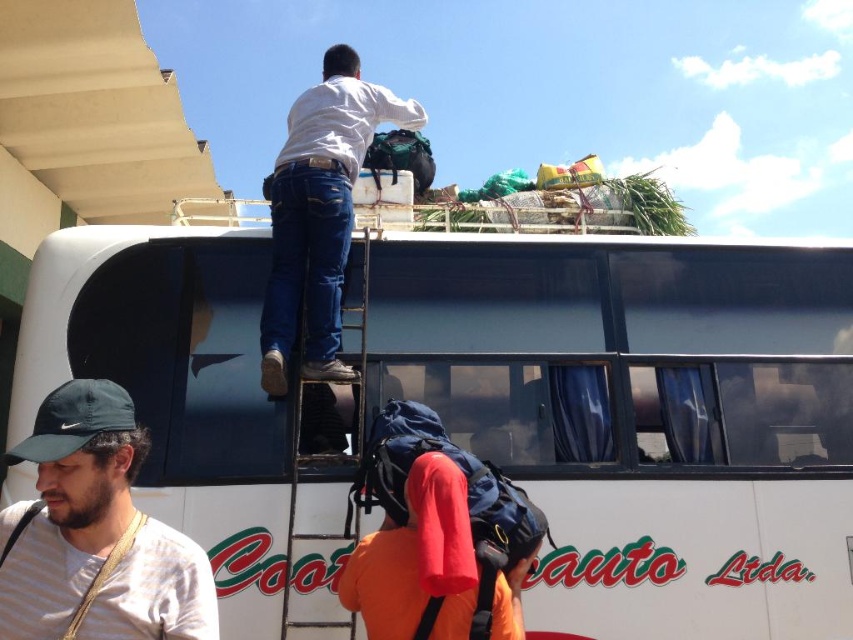
You are a delivery person who needs to reach the items on the roof of the bus. You see the metallic silver ladder at upper center and the striped cotton shirt at lower left. Which object is taller, allowing you to use it to reach the roof?

The metallic silver ladder at upper center is taller than the striped cotton shirt at lower left, so you can use the ladder to reach the roof.

You are a delivery person standing at the front of the bus. You need to place a package that requires a 30 inch space. Can you fit it between the striped cotton shirt at lower left and the orange fabric backpack at center?

The striped cotton shirt at lower left is 31.02 inches from orange fabric backpack at center. Since the required space is 30 inches, the package can fit between them.